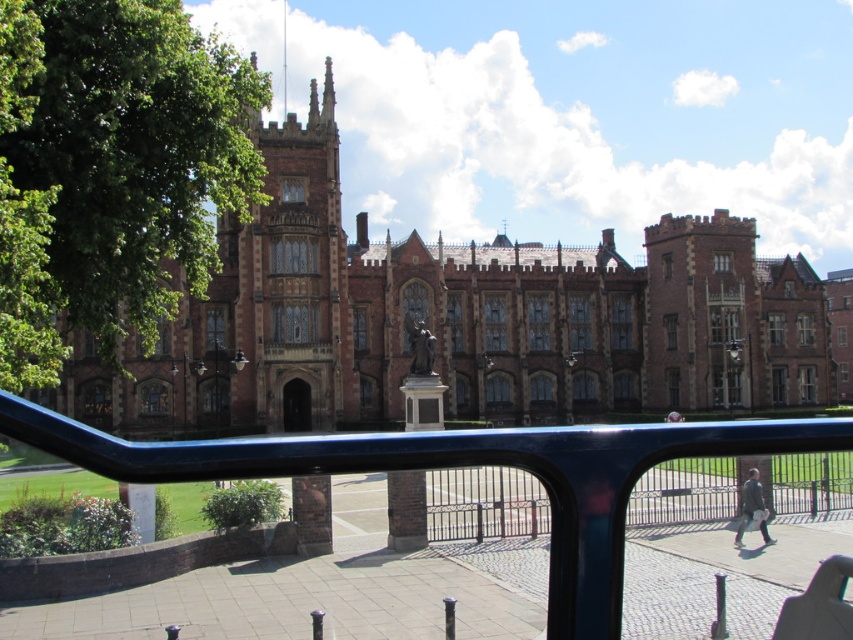
Based on the photo, you are a visitor approaching the brown stone palace at center and the glossy metal rail at center from the front entrance. Which object will you encounter first as you walk towards the building?

The brown stone palace at center will be encountered first because the glossy metal rail at center is positioned behind it, meaning the palace is closer to the visitor.

You are standing in the courtyard of the historic building and want to take a photo of the brown stone palace at center. Where should you position yourself to ensure the entire building is in frame?

To capture the entire brown stone palace at center in your photo, position yourself at point [457,321].

You are standing in the courtyard of a historic site and see the brown stone palace at center. If you want to take a photo of it from a distance of 100 meters, will you need to move closer or farther away?

The brown stone palace at center is currently 91.58 meters away from you. To achieve a distance of 100 meters, you need to move farther away from the brown stone palace at center.